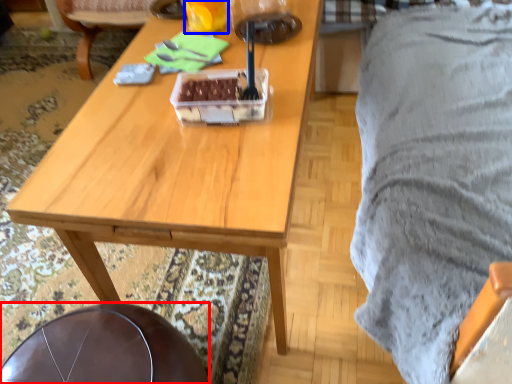
Question: Which object is closer to the camera taking this photo, chair (highlighted by a red box) or coffee cup (highlighted by a blue box)?

Choices:
 (A) chair
 (B) coffee cup

Answer: (A)